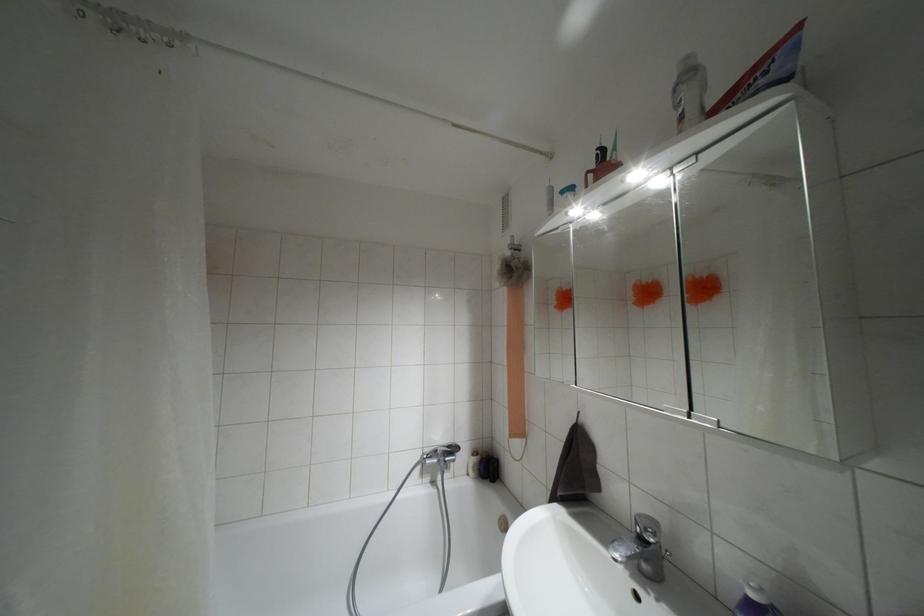
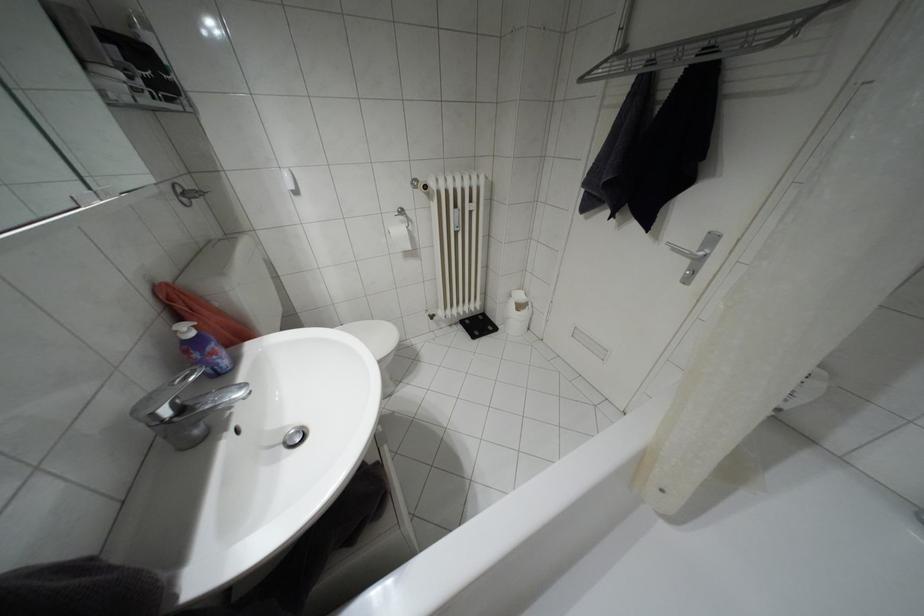
Where in the second image is the point corresponding to point (641, 538) from the first image?

(180, 408)